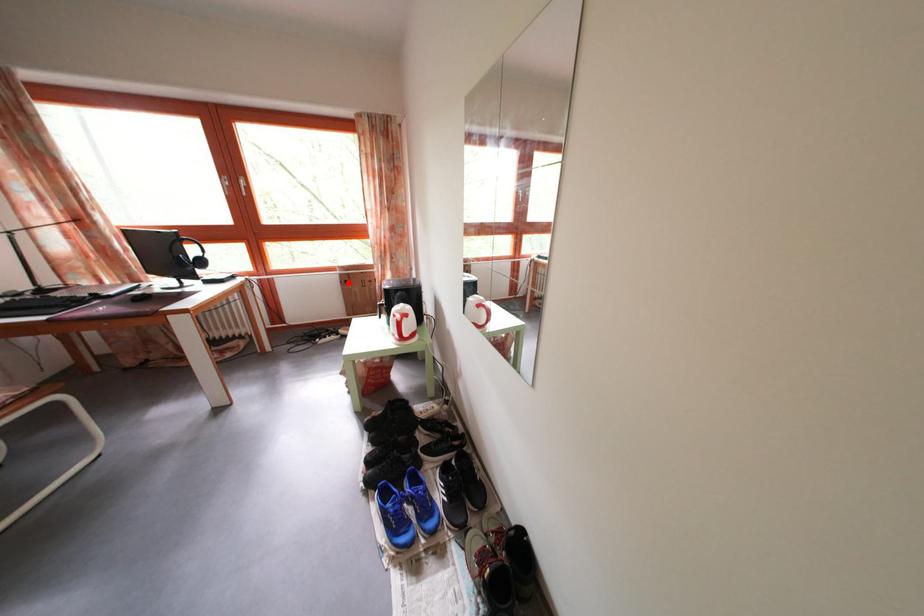
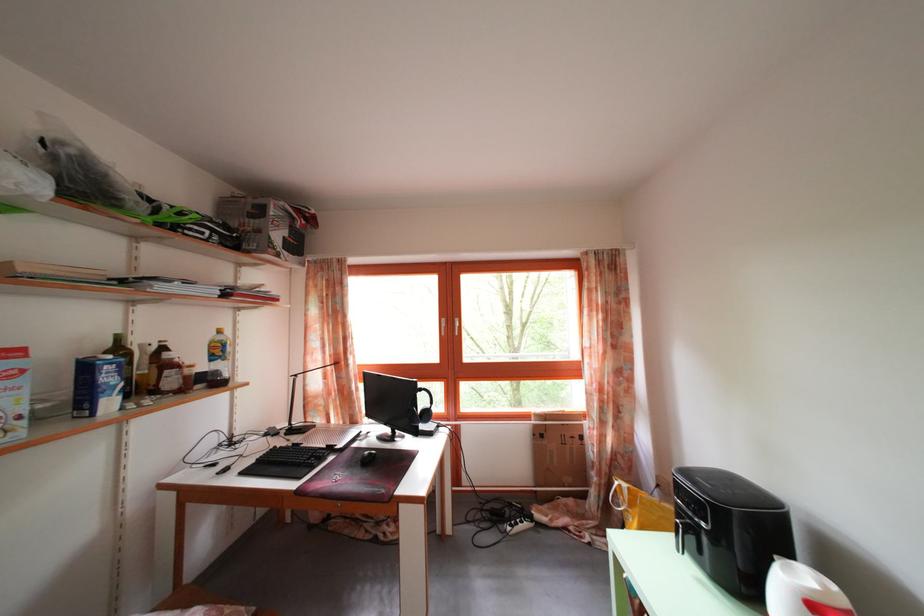
Question: I am providing you with two images of the same scene from different viewpoints. Given a red point in image1, look at the same physical point in image2. Is it:

Choices:
 (A) Closer to the viewpoint
 (B) Farther from the viewpoint

Answer: (B)